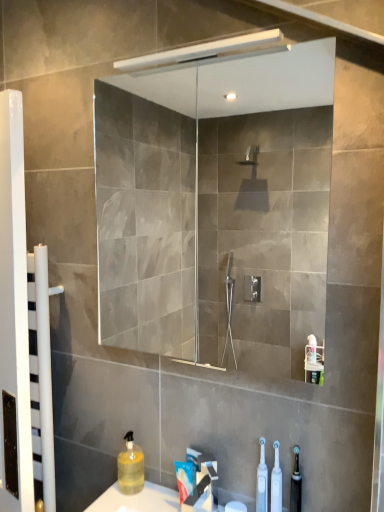
Question: Relative to white plastic toothbrush at lower center, the 1th cleaning product in the right-to-left sequence, is white glossy towel rack at left in front or behind?

Choices:
 (A) front
 (B) behind

Answer: (B)

Question: From a real-world perspective, relative to white plastic toothbrush at lower center, the 2th cleaning product positioned from the back, is white glossy towel rack at left vertically above or below?

Choices:
 (A) below
 (B) above

Answer: (B)

Question: Considering the real-world distances, which object is closest to the white glossy towel rack at left?

Choices:
 (A) white plastic toothbrushes at lower center, acting as the first toiletry starting from the left
 (B) white plastic toothbrush at lower center, which is the 1th cleaning product from front to back
 (C) white matte toothpaste at lower center
 (D) translucent plastic toothbrush at lower right, positioned as the first toiletry in right-to-left order
 (E) translucent yellow liquid at lower left, marked as the 1th cleaning product in a left-to-right arrangement

Answer: (E)

Question: Estimate the real-world distances between objects in this image. Which object is closer to the transparent glass mirror at upper center?

Choices:
 (A) white matte toothpaste at lower center
 (B) white plastic toothbrushes at lower center, acting as the first toiletry starting from the left
 (C) translucent yellow liquid at lower left, marked as the 1th cleaning product in a left-to-right arrangement
 (D) white plastic toothbrush at lower center, the 1th cleaning product in the right-to-left sequence
 (E) translucent plastic toothbrush at lower right, acting as the second toiletry starting from the left

Answer: (C)